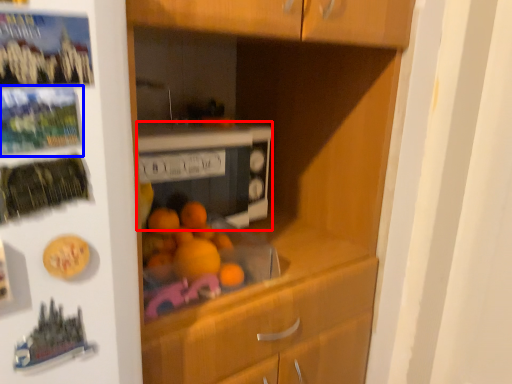
Question: Which point is closer to the camera, home appliance (highlighted by a red box) or button (highlighted by a blue box)?

Choices:
 (A) home appliance
 (B) button

Answer: (B)